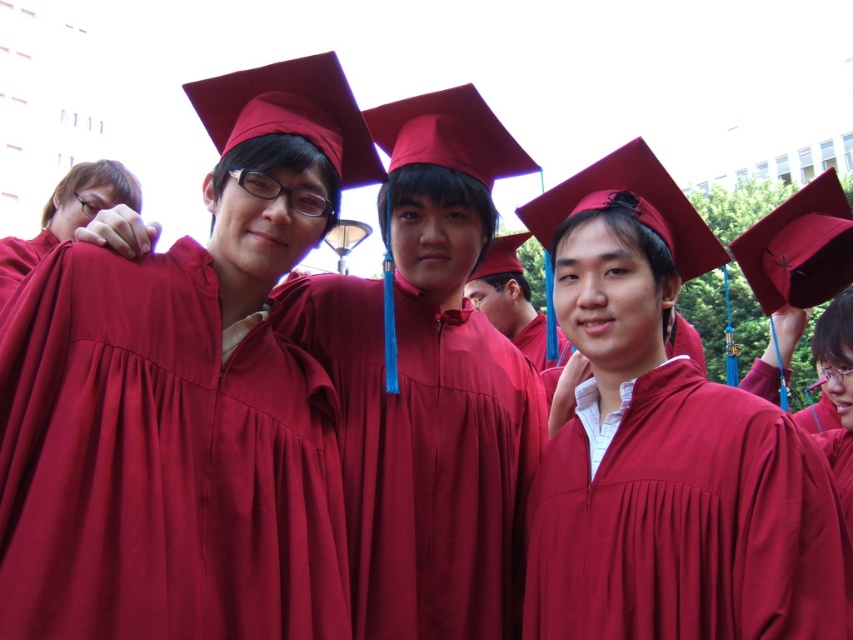
Can you confirm if matte maroon gown at center is positioned above maroon satin gown at center?

No.

Can you confirm if matte maroon gown at center is positioned to the right of maroon satin gown at center?

Correct, you'll find matte maroon gown at center to the right of maroon satin gown at center.

Describe the element at coordinates (688, 524) in the screenshot. I see `matte maroon gown at center` at that location.

Find the location of `matte maroon gown at center`. matte maroon gown at center is located at coordinates (688, 524).

How much distance is there between burgundy satin robe at center and matte maroon gown at center?

13.16 meters

Does point (33, 577) come farther from viewer compared to point (634, 401)?

No, (33, 577) is in front of (634, 401).

Image resolution: width=853 pixels, height=640 pixels. I want to click on burgundy satin robe at center, so click(x=161, y=461).

Based on the photo, is burgundy satin robe at center shorter than maroon satin gown at center?

Yes.

Between burgundy satin robe at center and maroon satin gown at center, which one appears on the left side from the viewer's perspective?

From the viewer's perspective, burgundy satin robe at center appears more on the left side.

Between point (6, 336) and point (384, 385), which one is positioned behind?

Positioned behind is point (384, 385).

Image resolution: width=853 pixels, height=640 pixels. Identify the location of burgundy satin robe at center. (161, 461).